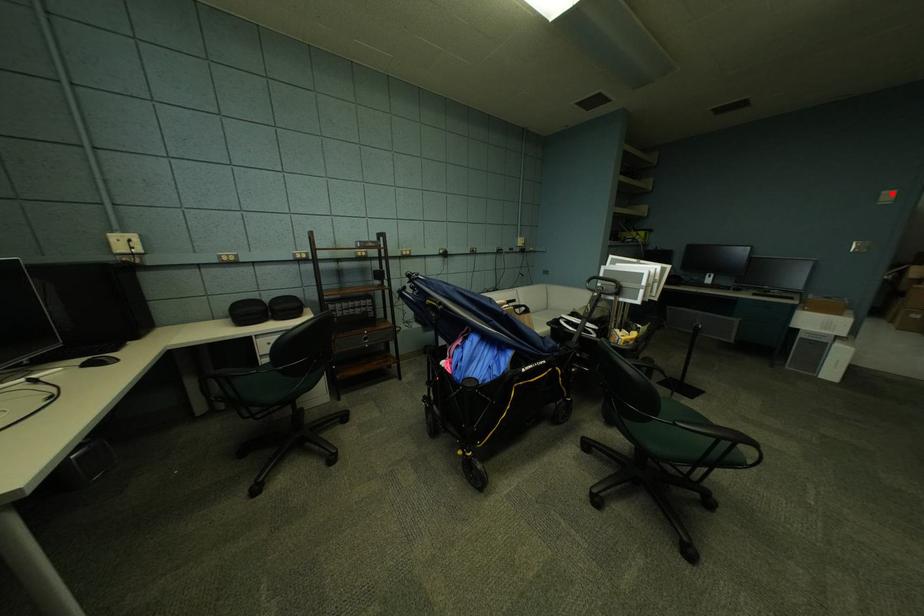
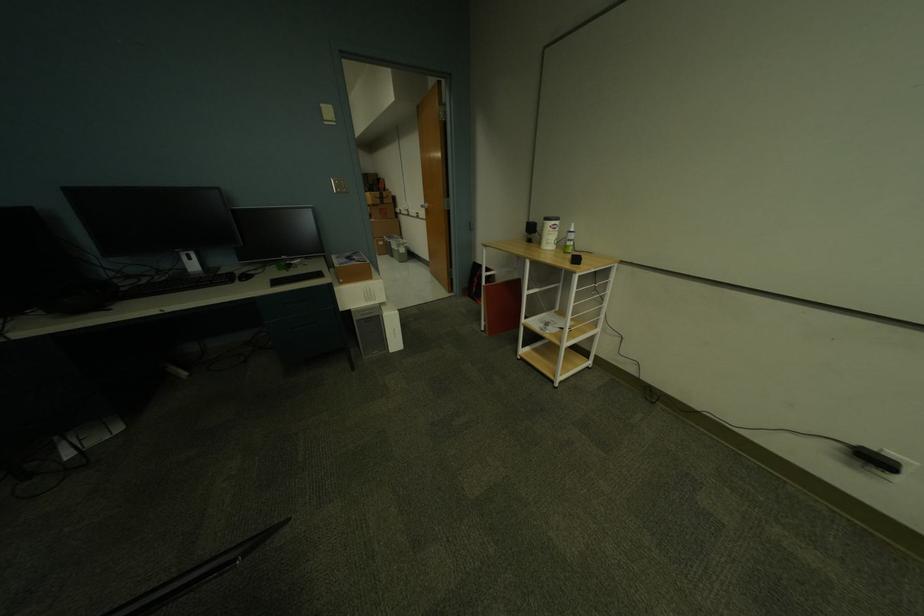
Question: I am providing you with two images of the same scene from different viewpoints. A red point is shown in image1. For the corresponding object point in image2, is it positioned nearer or farther from the camera?

Choices:
 (A) Nearer
 (B) Farther

Answer: (A)